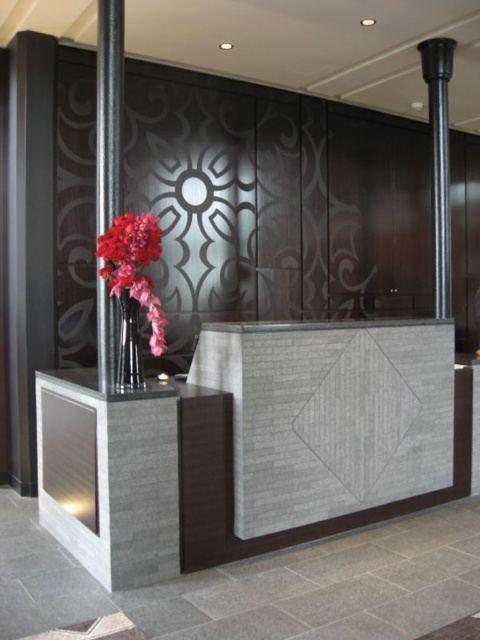
Question: Which of the following is the farthest from the observer?

Choices:
 (A) black polished column at left
 (B) polished metal pole at upper right
 (C) shiny metallic vase at center
 (D) matte glass vase at left

Answer: (B)

Question: Based on their relative distances, which object is nearer to the matte glass vase at left?

Choices:
 (A) polished metal pole at upper right
 (B) black polished column at left
 (C) shiny metallic vase at center

Answer: (C)

Question: Does polished metal pole at upper right come behind shiny metallic vase at center?

Choices:
 (A) no
 (B) yes

Answer: (B)

Question: Which object is the farthest from the shiny metallic vase at center?

Choices:
 (A) polished metal pole at upper right
 (B) black polished column at left
 (C) matte glass vase at left

Answer: (A)

Question: Does polished metal pole at upper right have a greater width compared to shiny metallic vase at center?

Choices:
 (A) no
 (B) yes

Answer: (B)

Question: In this image, where is black polished column at left located relative to matte glass vase at left?

Choices:
 (A) above
 (B) below

Answer: (A)